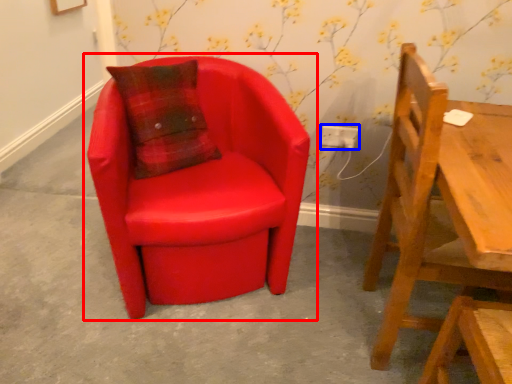
Question: Which of the following is the farthest to the observer, chair (highlighted by a red box) or electric outlet (highlighted by a blue box)?

Choices:
 (A) chair
 (B) electric outlet

Answer: (B)